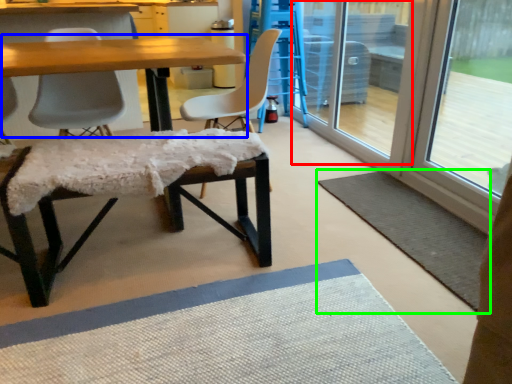
Question: Based on their relative distances, which object is farther from screen door (highlighted by a red box)? Choose from table (highlighted by a blue box) and yoga mat (highlighted by a green box).

Choices:
 (A) table
 (B) yoga mat

Answer: (A)